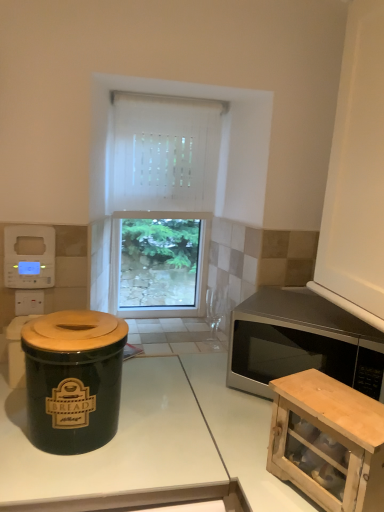
What are the coordinates of `vacant point above satin silver microwave at right (from a real-world perspective)` in the screenshot? It's located at (307, 317).